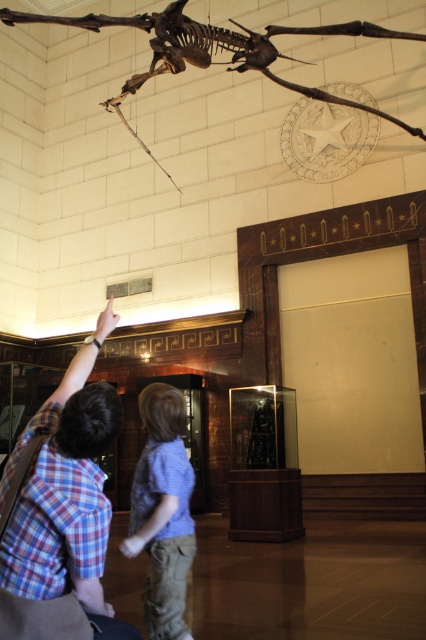
From the picture: You are standing in the museum and want to take a photo of the pterosaur skeleton. The camera you are using has a focal length of 50mm. If the point corresponding to the skeleton in the image is at coordinates point (163, 387), which is 3.80 meters away from you, what is the angle of view required to capture the entire skeleton in your photo?

The point (163, 387) is 3.80 meters away from the camera. To calculate the angle of view needed, you can use the formula for angle of view based on focal length and sensor size. However, without knowing the sensor size or the dimensions of the skeleton, it is impossible to determine the exact angle of view required to capture the entire skeleton in the photo.